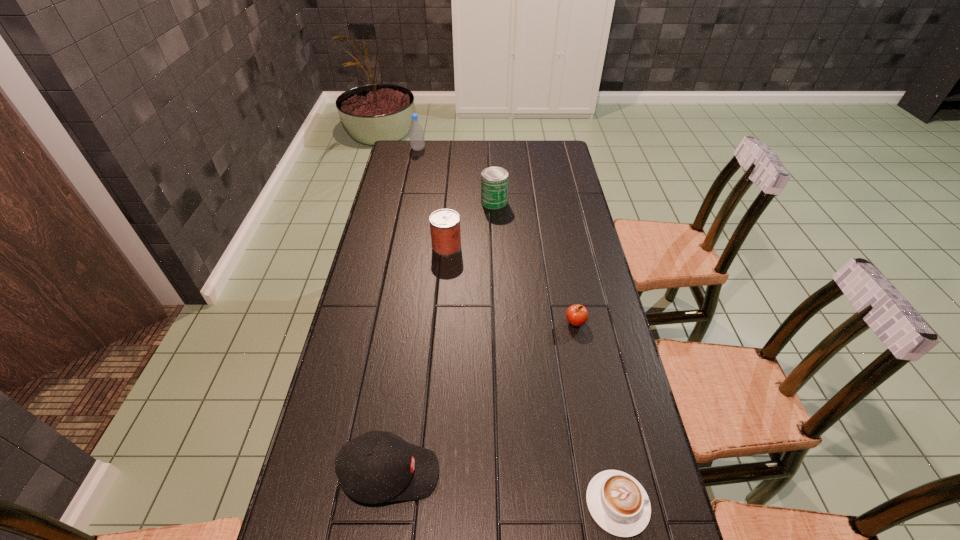
Image resolution: width=960 pixels, height=540 pixels. I want to click on vacant space located 0.200m on the front of the bottle, so click(413, 177).

The width and height of the screenshot is (960, 540). What are the coordinates of `blank space located on the front of the farther can` in the screenshot? It's located at (495, 222).

This screenshot has height=540, width=960. Find the location of `vacant area situated 0.390m on the back of the left can`. vacant area situated 0.390m on the back of the left can is located at coordinates (452, 178).

Identify the location of free space located with a logo on the front of the baseball cap. (523, 474).

Find the location of `free space located 0.360m on the left of the second shortest object`. free space located 0.360m on the left of the second shortest object is located at coordinates pos(444,322).

Locate an element on the screen. The width and height of the screenshot is (960, 540). object at the far edge is located at coordinates (416, 133).

Where is `bottle that is positioned at the left edge`? The width and height of the screenshot is (960, 540). bottle that is positioned at the left edge is located at coordinates (416, 133).

Identify the location of baseball cap that is at the left edge. The height and width of the screenshot is (540, 960). (375, 467).

Where is `apple that is positioned at the right edge`? The width and height of the screenshot is (960, 540). apple that is positioned at the right edge is located at coordinates (577, 315).

You are a GUI agent. You are given a task and a screenshot of the screen. Output one action in this format:
    pyautogui.click(x=<x>, y=<y>)
    Task: Click on the cappuccino that is at the right edge
    This screenshot has width=960, height=540.
    Given the screenshot: What is the action you would take?
    pyautogui.click(x=617, y=502)